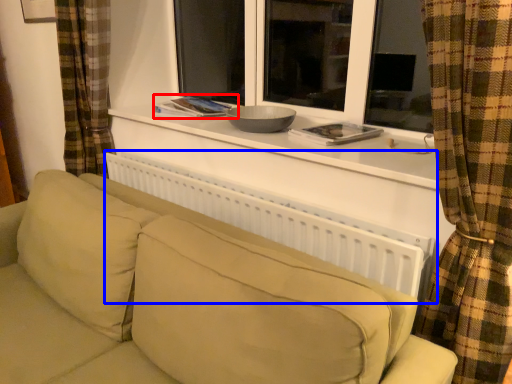
Question: Which point is further to the camera, book (highlighted by a red box) or radiator (highlighted by a blue box)?

Choices:
 (A) book
 (B) radiator

Answer: (A)